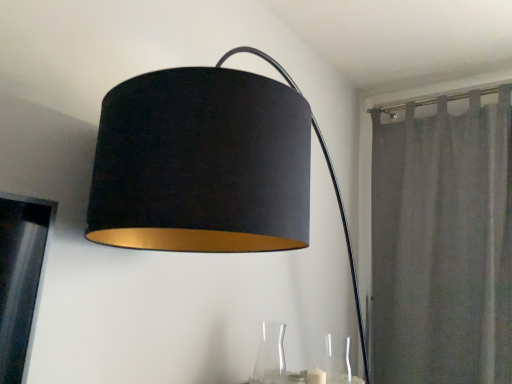
Question: From the image's perspective, does transparent glass vase at lower right, which is the second glass vase in left-to-right order, appear higher than transparent glass vase at lower center, the first glass vase viewed from the left?

Choices:
 (A) yes
 (B) no

Answer: (B)

Question: Is transparent glass vase at lower center, which is the 2th glass vase from right to left, a part of transparent glass vase at lower right, arranged as the 1th glass vase when viewed from the right?

Choices:
 (A) yes
 (B) no

Answer: (B)

Question: Considering the relative sizes of transparent glass vase at lower right, which is the second glass vase in left-to-right order, and transparent glass vase at lower center, the first glass vase viewed from the left, in the image provided, is transparent glass vase at lower right, which is the second glass vase in left-to-right order, taller than transparent glass vase at lower center, the first glass vase viewed from the left,?

Choices:
 (A) yes
 (B) no

Answer: (B)

Question: Considering the relative sizes of transparent glass vase at lower right, which is the second glass vase in left-to-right order, and transparent glass vase at lower center, the first glass vase viewed from the left, in the image provided, is transparent glass vase at lower right, which is the second glass vase in left-to-right order, bigger than transparent glass vase at lower center, the first glass vase viewed from the left,?

Choices:
 (A) yes
 (B) no

Answer: (B)

Question: Does transparent glass vase at lower right, which is the second glass vase in left-to-right order, appear on the left side of transparent glass vase at lower center, which is the 2th glass vase from right to left?

Choices:
 (A) no
 (B) yes

Answer: (A)

Question: In terms of height, does transparent glass vase at lower right, arranged as the 1th glass vase when viewed from the right, look taller or shorter compared to gray fabric curtain at right?

Choices:
 (A) tall
 (B) short

Answer: (B)

Question: From the image's perspective, is transparent glass vase at lower right, arranged as the 1th glass vase when viewed from the right, above or below gray fabric curtain at right?

Choices:
 (A) below
 (B) above

Answer: (A)

Question: Relative to gray fabric curtain at right, is transparent glass vase at lower right, which is the second glass vase in left-to-right order, in front or behind?

Choices:
 (A) front
 (B) behind

Answer: (A)

Question: Does point (337, 349) appear closer or farther from the camera than point (444, 114)?

Choices:
 (A) farther
 (B) closer

Answer: (B)

Question: From the image's perspective, is transparent glass vase at lower right, arranged as the 1th glass vase when viewed from the right, located above or below transparent glass vase at lower center, the first glass vase viewed from the left?

Choices:
 (A) above
 (B) below

Answer: (B)

Question: From a real-world perspective, relative to transparent glass vase at lower center, which is the 2th glass vase from right to left, is transparent glass vase at lower right, which is the second glass vase in left-to-right order, vertically above or below?

Choices:
 (A) below
 (B) above

Answer: (A)

Question: In the image, is transparent glass vase at lower right, which is the second glass vase in left-to-right order, on the left side or the right side of transparent glass vase at lower center, which is the 2th glass vase from right to left?

Choices:
 (A) left
 (B) right

Answer: (B)

Question: Based on their sizes in the image, would you say transparent glass vase at lower right, which is the second glass vase in left-to-right order, is bigger or smaller than transparent glass vase at lower center, the first glass vase viewed from the left?

Choices:
 (A) big
 (B) small

Answer: (B)

Question: Is point (318, 377) positioned closer to the camera than point (348, 342)?

Choices:
 (A) farther
 (B) closer

Answer: (B)

Question: In the image, is white matte candle at lower center positioned in front of or behind transparent glass vase at lower right, which is the second glass vase in left-to-right order?

Choices:
 (A) front
 (B) behind

Answer: (B)